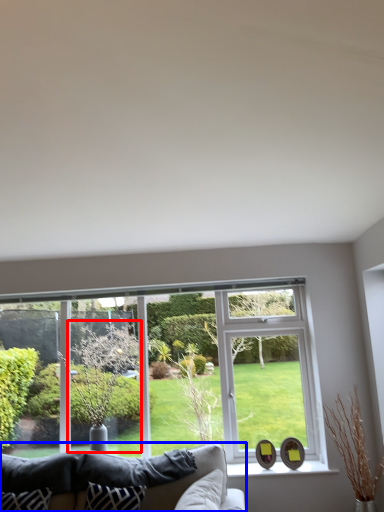
Question: Which object appears farthest to the camera in this image, tree (highlighted by a red box) or studio couch (highlighted by a blue box)?

Choices:
 (A) tree
 (B) studio couch

Answer: (A)